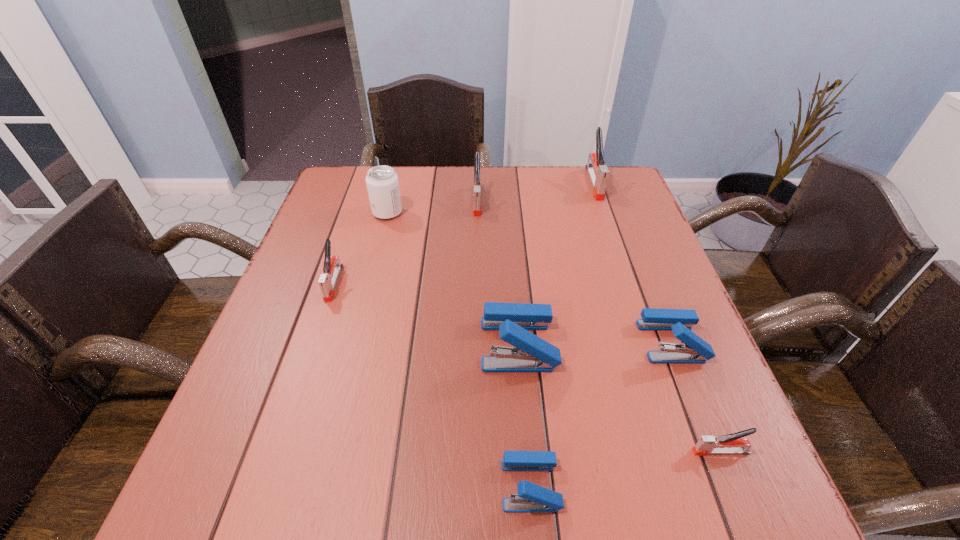
Identify the location of the second closest blue stapler to the biggest blue stapler. The width and height of the screenshot is (960, 540). (695, 350).

Locate an element on the screen. The height and width of the screenshot is (540, 960). the second closest blue stapler to the biggest blue stapler is located at coordinates (695, 350).

Find the location of a particular element. This screenshot has height=540, width=960. blank space that satisfies the following two spatial constraints: 1. on the front side of the seventh object from right to left; 2. on the right side of the rightmost blue stapler is located at coordinates (354, 341).

Locate an element on the screen. This screenshot has width=960, height=540. free space that satisfies the following two spatial constraints: 1. on the front side of the smallest blue stapler; 2. on the right side of the soda can is located at coordinates (318, 484).

Locate an element on the screen. This screenshot has width=960, height=540. free space that satisfies the following two spatial constraints: 1. on the handle side of the biggest blue stapler; 2. on the right side of the leftmost stapler is located at coordinates (313, 344).

Where is `free spot that satisfies the following two spatial constraints: 1. on the handle side of the rightmost blue stapler; 2. on the left side of the leftmost object`? free spot that satisfies the following two spatial constraints: 1. on the handle side of the rightmost blue stapler; 2. on the left side of the leftmost object is located at coordinates (314, 341).